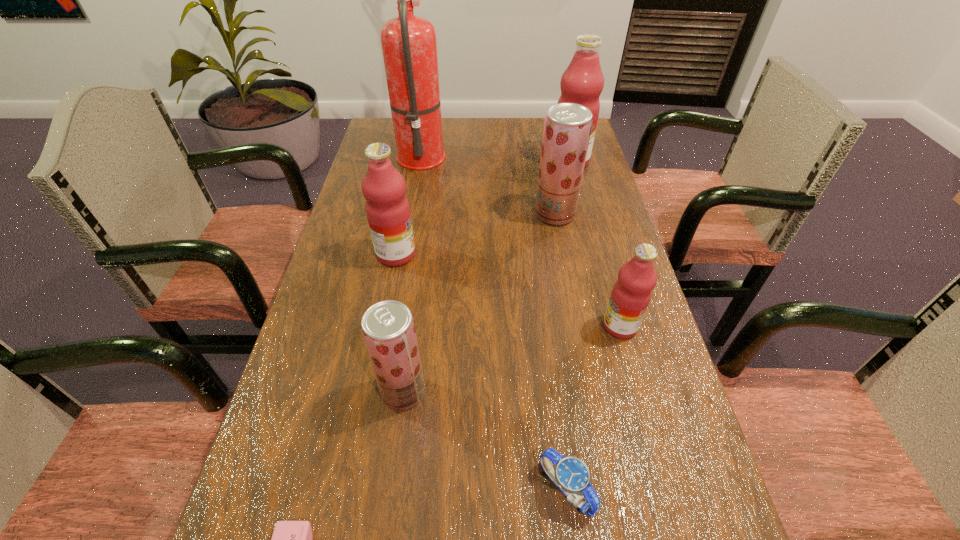
The image size is (960, 540). What are the coordinates of `fire extinguisher` in the screenshot? It's located at (x=409, y=46).

You are a GUI agent. You are given a task and a screenshot of the screen. Output one action in this format:
    pyautogui.click(x=<x>, y=<y>)
    Task: Click on the tallest object
    The height and width of the screenshot is (540, 960).
    Given the screenshot: What is the action you would take?
    pyautogui.click(x=409, y=46)

The height and width of the screenshot is (540, 960). I want to click on the tallest fruit juice, so click(x=582, y=82).

Identify the location of the biggest pink fruit juice. This screenshot has width=960, height=540. 582,82.

Where is `the sixth nearest object`? This screenshot has width=960, height=540. the sixth nearest object is located at coordinates (567, 127).

Find the location of a particular element. The height and width of the screenshot is (540, 960). the bigger strawberry fruit juice is located at coordinates (567, 127).

This screenshot has width=960, height=540. Identify the location of the second smallest pink fruit juice. (388, 212).

The height and width of the screenshot is (540, 960). I want to click on the third nearest fruit juice, so click(388, 212).

You are a GUI agent. You are given a task and a screenshot of the screen. Output one action in this format:
    pyautogui.click(x=<x>, y=<y>)
    Task: Click on the fourth nearest object
    The image size is (960, 540).
    Given the screenshot: What is the action you would take?
    pyautogui.click(x=631, y=294)

Where is `the second nearest fruit juice`? the second nearest fruit juice is located at coordinates (631, 294).